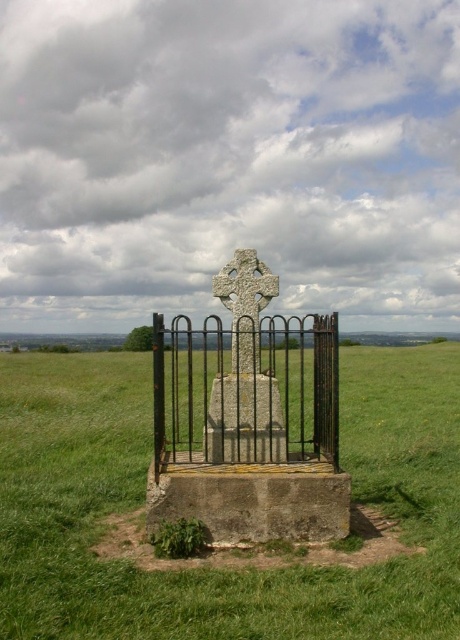
From the picture: You are a landscape architect designing a pathway around the black wrought iron fence at center and the white stone cross at center. Which object will require a taller clearance when planning the pathway?

The black wrought iron fence at center is taller than the white stone cross at center, so the pathway must have a taller clearance for the black wrought iron fence at center.

Consider the image. You are a landscape architect designing a walking path that needs to pass between the green grassy at center and the black wrought iron fence at center. Based on the scene description, which side of the path should be wider to accommodate more visitors?

The green grassy at center has a larger width than the black wrought iron fence at center, so the path should be wider on the side of the green grassy at center to accommodate more visitors.

You are a landscape architect designing a pathway around the green grassy at center and the white stone cross at center. Which area requires a wider path to accommodate visitors?

The green grassy at center requires a wider path because it is wider than the white stone cross at center according to the description.